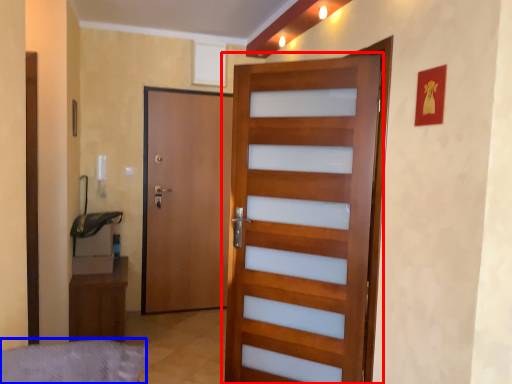
Question: Which object is further to the camera taking this photo, door (highlighted by a red box) or bed frame (highlighted by a blue box)?

Choices:
 (A) door
 (B) bed frame

Answer: (A)